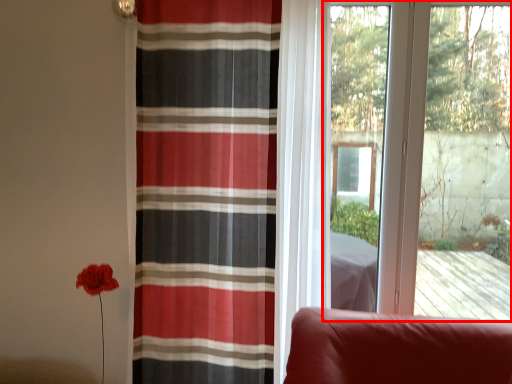
Question: From the image's perspective, what is the correct spatial relationship of window (annotated by the red box) in relation to curtain?

Choices:
 (A) above
 (B) below

Answer: (A)